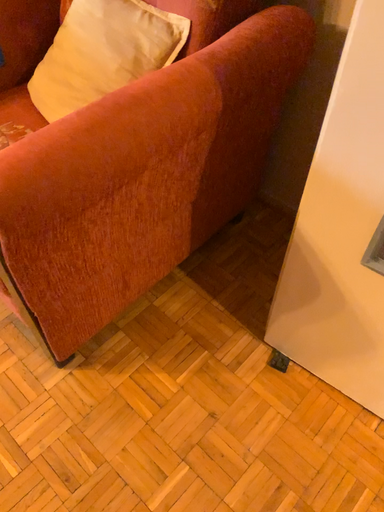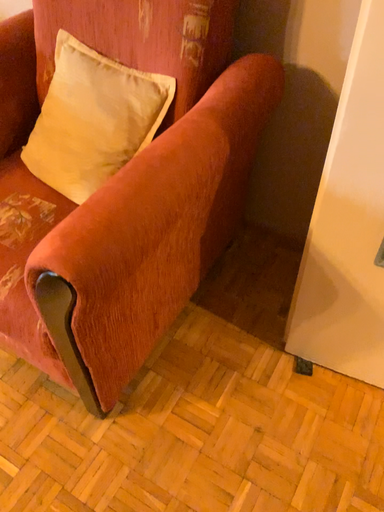
Question: How did the camera likely rotate when shooting the video?

Choices:
 (A) rotated right
 (B) rotated left

Answer: (A)